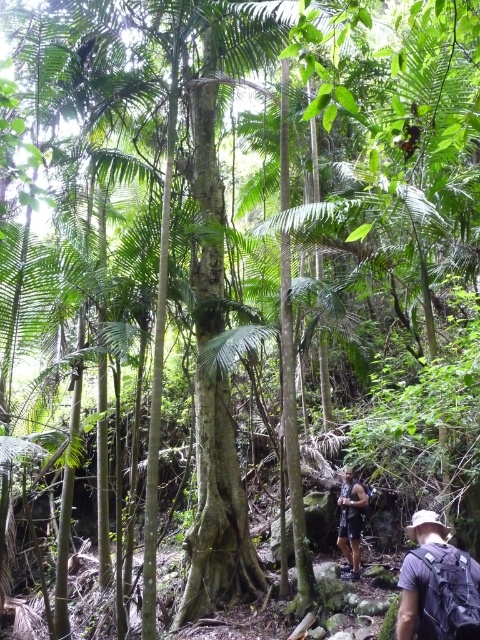
Question: Which point is farther to the camera?

Choices:
 (A) gray fabric backpack at lower right
 (B) dark brown leather backpack at lower right

Answer: (B)

Question: Which object is farther from the camera taking this photo?

Choices:
 (A) dark brown leather backpack at lower right
 (B) gray fabric backpack at lower right

Answer: (A)

Question: Does gray fabric backpack at lower right appear over dark brown leather backpack at lower right?

Choices:
 (A) no
 (B) yes

Answer: (B)

Question: Considering the relative positions of gray fabric backpack at lower right and dark brown leather backpack at lower right in the image provided, where is gray fabric backpack at lower right located with respect to dark brown leather backpack at lower right?

Choices:
 (A) above
 (B) below

Answer: (A)

Question: Which object appears farthest from the camera in this image?

Choices:
 (A) gray fabric backpack at lower right
 (B) dark brown leather backpack at lower right

Answer: (B)

Question: Where is gray fabric backpack at lower right located in relation to dark brown leather backpack at lower right in the image?

Choices:
 (A) below
 (B) above

Answer: (B)